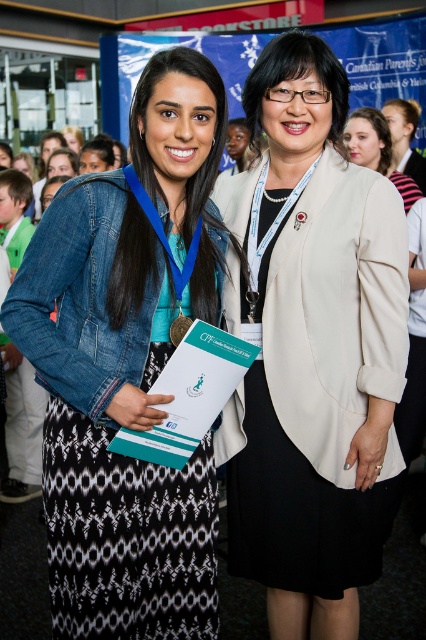
Question: Which of the following is the closest to the observer?

Choices:
 (A) (377, 148)
 (B) (201, 150)

Answer: (B)

Question: Can you confirm if beige fabric blazer at center is positioned to the left of denim jacket at left?

Choices:
 (A) yes
 (B) no

Answer: (B)

Question: Among these points, which one is farthest from the camera?

Choices:
 (A) (414, 186)
 (B) (48, 365)

Answer: (A)

Question: Does denim jacket at left appear over matte beige blazer at upper center?

Choices:
 (A) no
 (B) yes

Answer: (A)

Question: Is denim jacket at left positioned in front of matte beige blazer at upper center?

Choices:
 (A) yes
 (B) no

Answer: (A)

Question: Which object appears closest to the camera in this image?

Choices:
 (A) denim jacket at left
 (B) matte beige blazer at upper center

Answer: (A)